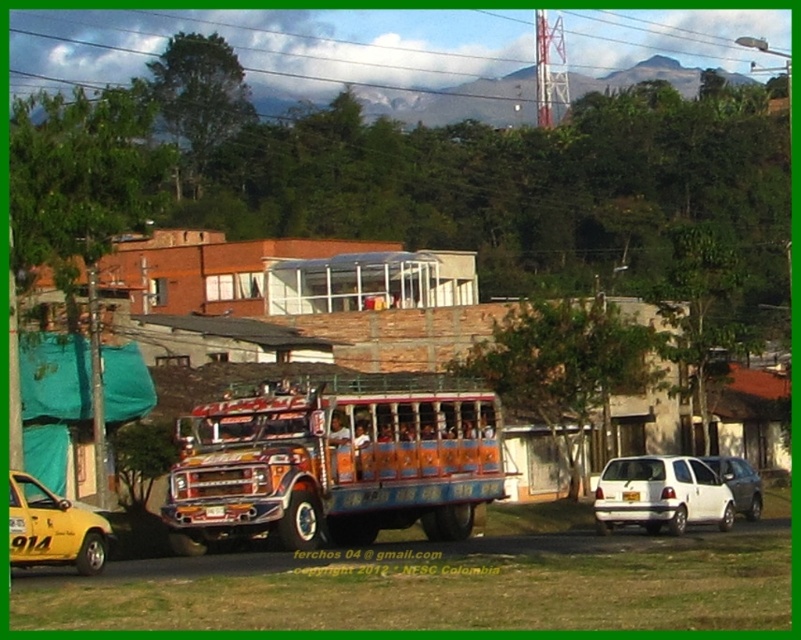
You are a pedestrian standing at the edge of the street where the painted wood bus at center and the white matte van at center are parked. You need to cross the street to reach a store on the other side. Is there enough space between the two vehicles to safely walk through?

The distance between the painted wood bus at center and the white matte van at center is 45.55 feet, which provides ample space for a pedestrian to safely walk through between them.

You are a pedestrian standing on the street and want to cross to the other side. The painted wood bus at center and the white matte van at center are blocking your path. Which vehicle should you move around first to reach the other side safely?

The painted wood bus at center is positioned over white matte van at center, so you should move around the painted wood bus at center first to reach the other side safely.